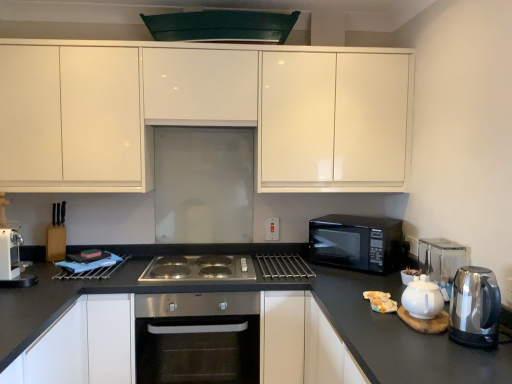
Question: Could you tell me if white glossy teapot at right is turned towards green matte exhaust hood at upper center?

Choices:
 (A) yes
 (B) no

Answer: (B)

Question: Is white glossy teapot at right positioned with its back to green matte exhaust hood at upper center?

Choices:
 (A) yes
 (B) no

Answer: (B)

Question: From a real-world perspective, is white glossy teapot at right on top of green matte exhaust hood at upper center?

Choices:
 (A) yes
 (B) no

Answer: (B)

Question: Is the position of white glossy teapot at right less distant than that of green matte exhaust hood at upper center?

Choices:
 (A) yes
 (B) no

Answer: (A)

Question: Can you see white glossy teapot at right touching green matte exhaust hood at upper center?

Choices:
 (A) no
 (B) yes

Answer: (A)

Question: Looking at their shapes, would you say white glossy teapot at right is wider or thinner than white glossy teapot at right?

Choices:
 (A) thin
 (B) wide

Answer: (B)

Question: From a real-world perspective, is white glossy teapot at right physically located above or below white glossy teapot at right?

Choices:
 (A) below
 (B) above

Answer: (A)

Question: Relative to white glossy teapot at right, is white glossy teapot at right in front or behind?

Choices:
 (A) front
 (B) behind

Answer: (A)

Question: Looking at the image, does white glossy teapot at right seem bigger or smaller compared to white glossy teapot at right?

Choices:
 (A) big
 (B) small

Answer: (B)

Question: From a real-world perspective, relative to stainless steel oven at center, is black glossy microwave at right vertically above or below?

Choices:
 (A) below
 (B) above

Answer: (B)

Question: Is black glossy microwave at right spatially inside stainless steel oven at center, or outside of it?

Choices:
 (A) outside
 (B) inside

Answer: (A)

Question: Is black glossy microwave at right in front of or behind stainless steel oven at center in the image?

Choices:
 (A) behind
 (B) front

Answer: (A)

Question: Considering the positions of black glossy microwave at right and stainless steel oven at center in the image, is black glossy microwave at right wider or thinner than stainless steel oven at center?

Choices:
 (A) wide
 (B) thin

Answer: (B)

Question: In terms of height, does white plastic coffee machine at left look taller or shorter compared to white glossy cabinet at lower left, which is the 2th cabinetry in top-to-bottom order?

Choices:
 (A) short
 (B) tall

Answer: (A)

Question: Visually, is white plastic coffee machine at left positioned to the left or to the right of white glossy cabinet at lower left, arranged as the 1th cabinetry when ordered from the bottom?

Choices:
 (A) left
 (B) right

Answer: (A)